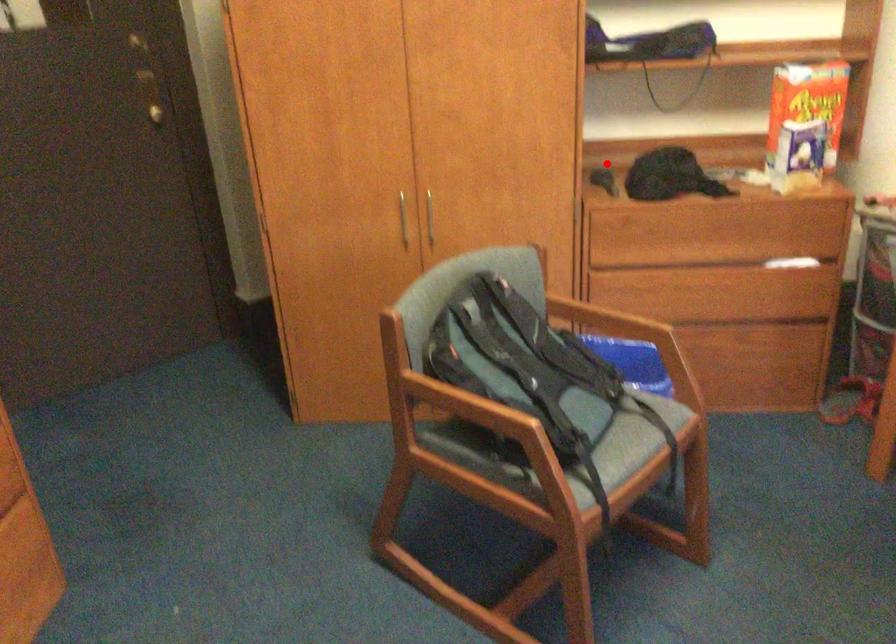
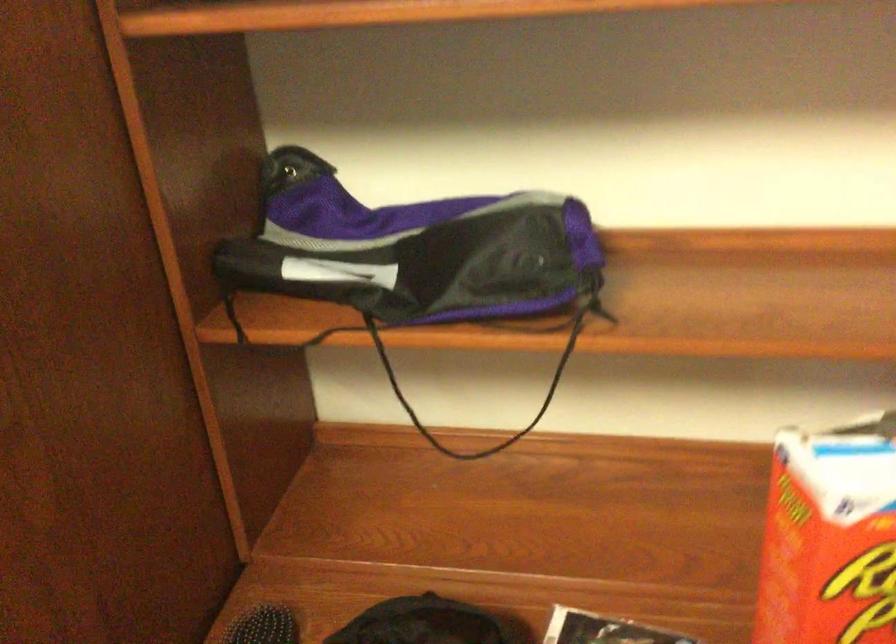
In the second image, find the point that corresponds to the highlighted location in the first image.

(263, 626)